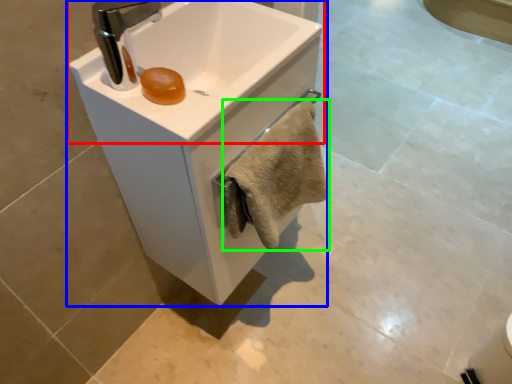
Question: Considering the real-world distances, which object is closest to sink (highlighted by a red box)? sink (highlighted by a blue box) or bath towel (highlighted by a green box).

Choices:
 (A) sink
 (B) bath towel

Answer: (A)